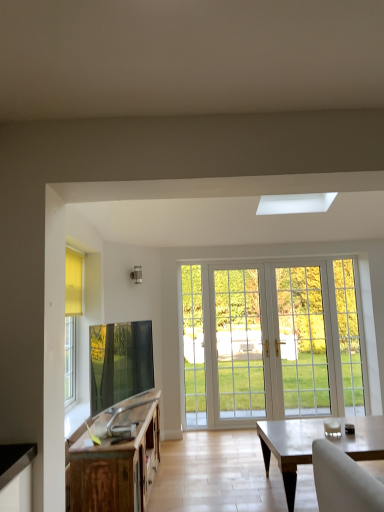
Question: Is the surface of matte wooden coffee table at lower right in direct contact with wooden cabinet at lower left?

Choices:
 (A) no
 (B) yes

Answer: (A)

Question: Does matte wooden coffee table at lower right have a lesser height compared to wooden cabinet at lower left?

Choices:
 (A) no
 (B) yes

Answer: (B)

Question: Is matte wooden coffee table at lower right to the left of wooden cabinet at lower left from the viewer's perspective?

Choices:
 (A) yes
 (B) no

Answer: (B)

Question: Considering the relative sizes of matte wooden coffee table at lower right and wooden cabinet at lower left in the image provided, is matte wooden coffee table at lower right wider than wooden cabinet at lower left?

Choices:
 (A) no
 (B) yes

Answer: (B)

Question: Is matte wooden coffee table at lower right not near wooden cabinet at lower left?

Choices:
 (A) no
 (B) yes

Answer: (B)

Question: Is matte wooden coffee table at lower right oriented towards wooden cabinet at lower left?

Choices:
 (A) no
 (B) yes

Answer: (A)

Question: Can you confirm if wooden cabinet at lower left is wider than matte wooden coffee table at lower right?

Choices:
 (A) yes
 (B) no

Answer: (B)

Question: From the image's perspective, is wooden cabinet at lower left on matte wooden coffee table at lower right?

Choices:
 (A) no
 (B) yes

Answer: (B)

Question: Is wooden cabinet at lower left thinner than matte wooden coffee table at lower right?

Choices:
 (A) yes
 (B) no

Answer: (A)

Question: Is wooden cabinet at lower left aimed at matte wooden coffee table at lower right?

Choices:
 (A) yes
 (B) no

Answer: (A)

Question: Is wooden cabinet at lower left outside of matte wooden coffee table at lower right?

Choices:
 (A) yes
 (B) no

Answer: (A)

Question: Is wooden cabinet at lower left at the right side of matte wooden coffee table at lower right?

Choices:
 (A) yes
 (B) no

Answer: (B)

Question: In terms of width, does matte wooden coffee table at lower right look wider or thinner when compared to wooden cabinet at lower left?

Choices:
 (A) wide
 (B) thin

Answer: (A)